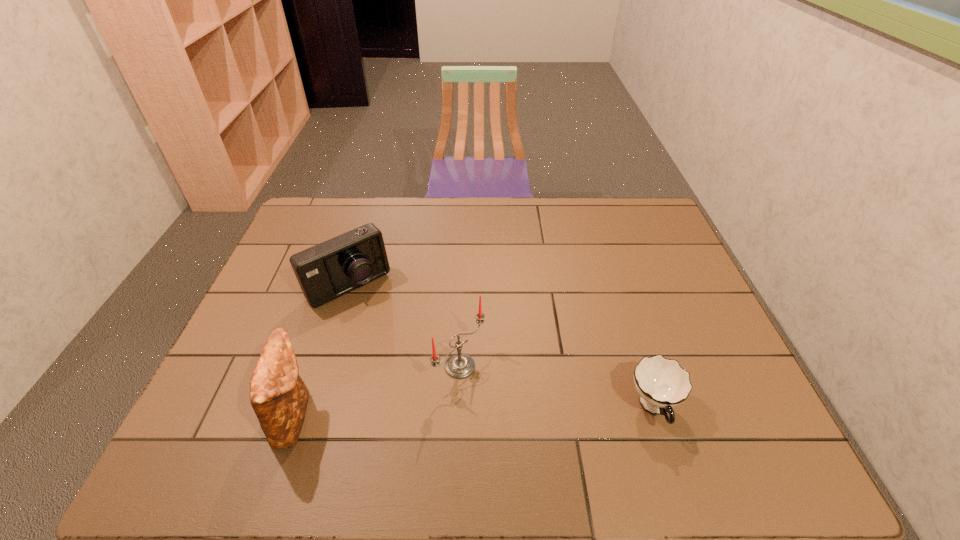
The width and height of the screenshot is (960, 540). Find the location of `unoccupied position between the candle and the cup`. unoccupied position between the candle and the cup is located at coordinates (557, 387).

Identify the location of the second closest object to the camera. The height and width of the screenshot is (540, 960). 279,397.

Select which object is the second closest to the camera. Please provide its 2D coordinates. Your answer should be formatted as a tuple, i.e. [(x, y)], where the tuple contains the x and y coordinates of a point satisfying the conditions above.

[(279, 397)]